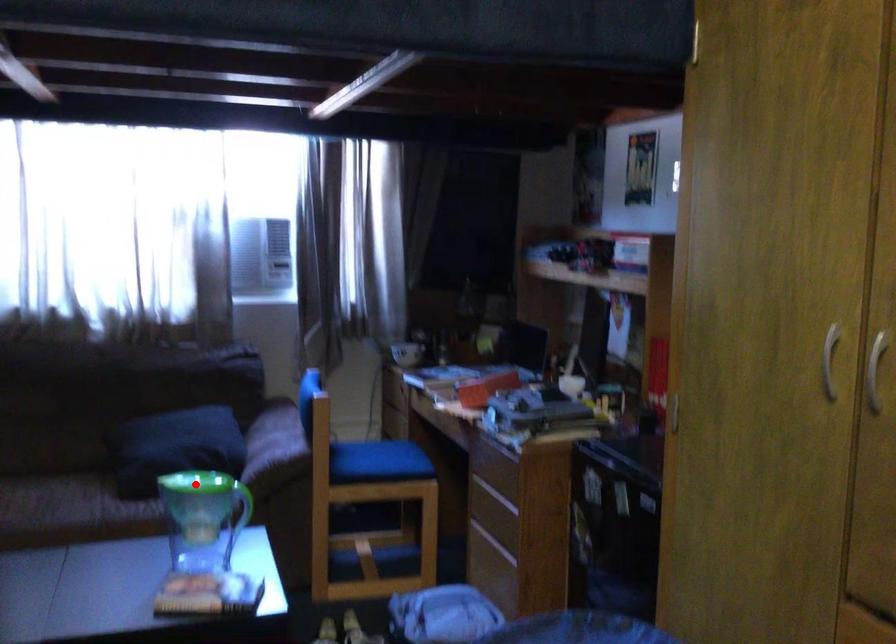
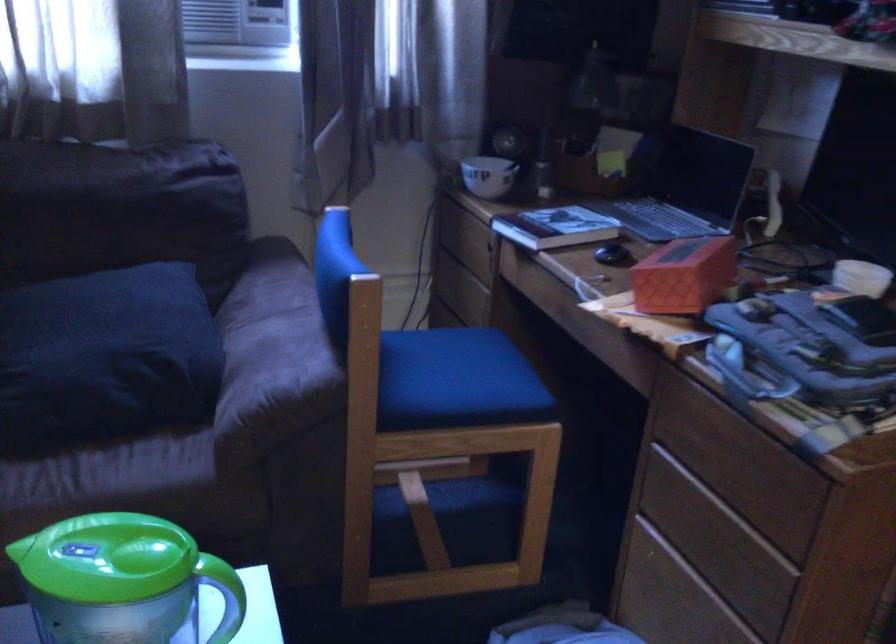
Question: I am providing you with two images of the same scene from different viewpoints. Image1 has a red point marked. In image2, the corresponding 3D location appears at what relative position? Reply with the corresponding letter.

Choices:
 (A) Closer
 (B) Farther

Answer: (A)